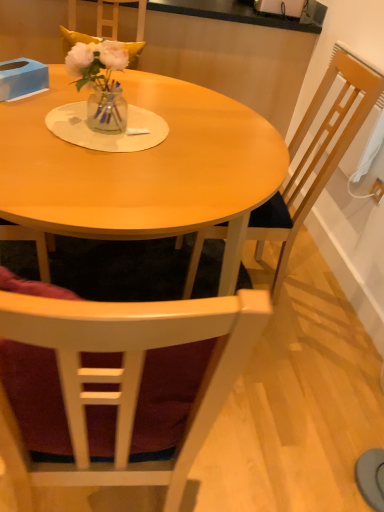
What do you see at coordinates (101, 82) in the screenshot? The height and width of the screenshot is (512, 384). I see `translucent glass vase at center` at bounding box center [101, 82].

Image resolution: width=384 pixels, height=512 pixels. I want to click on blue cardboard box at upper left, so click(x=22, y=78).

Are translucent glass vase at center and wooden chair at center, which is the first chair in bottom-to-top order, beside each other?

translucent glass vase at center and wooden chair at center, which is the first chair in bottom-to-top order, are not in contact.

Measure the distance between translucent glass vase at center and wooden chair at center, which is the first chair in bottom-to-top order.

A distance of 34.81 inches exists between translucent glass vase at center and wooden chair at center, which is the first chair in bottom-to-top order.

Is translucent glass vase at center positioned with its back to wooden chair at center, the 2th chair positioned from the top?

No, translucent glass vase at center is not facing the opposite direction of wooden chair at center, the 2th chair positioned from the top.

Who is bigger, translucent glass vase at center or wooden chair at center, which is the first chair in bottom-to-top order?

wooden chair at center, which is the first chair in bottom-to-top order.

Considering the sizes of objects wooden chair at right, the second chair when ordered from bottom to top, and translucent glass vase at center in the image provided, who is smaller, wooden chair at right, the second chair when ordered from bottom to top, or translucent glass vase at center?

Smaller between the two is translucent glass vase at center.

Is wooden chair at right, the second chair when ordered from bottom to top, facing towards translucent glass vase at center?

Yes, wooden chair at right, the second chair when ordered from bottom to top, is turned towards translucent glass vase at center.

From a real-world perspective, is wooden chair at right, positioned as the 1th chair in top-to-bottom order, under translucent glass vase at center?

Indeed, from a real-world perspective, wooden chair at right, positioned as the 1th chair in top-to-bottom order, is positioned beneath translucent glass vase at center.

In order to click on floral arrangement that appears above the wooden chair at right, positioned as the 1th chair in top-to-bottom order (from the image's perspective) in this screenshot , I will do `click(101, 82)`.

Is wooden chair at right, positioned as the 1th chair in top-to-bottom order, positioned with its back to blue cardboard box at upper left?

wooden chair at right, positioned as the 1th chair in top-to-bottom order, does not have its back to blue cardboard box at upper left.

Which object is closer to the camera taking this photo, wooden chair at right, positioned as the 1th chair in top-to-bottom order, or blue cardboard box at upper left?

wooden chair at right, positioned as the 1th chair in top-to-bottom order, is closer to the camera.

Between wooden chair at right, the second chair when ordered from bottom to top, and blue cardboard box at upper left, which one has smaller size?

With smaller size is blue cardboard box at upper left.

Is wooden chair at right, the second chair when ordered from bottom to top, not close to blue cardboard box at upper left?

wooden chair at right, the second chair when ordered from bottom to top, is near blue cardboard box at upper left, not far away.

From a real-world perspective, is matte wood table at center physically located above or below blue cardboard box at upper left?

Clearly, from a real-world perspective, matte wood table at center is below blue cardboard box at upper left.

Looking at this image, how far apart are matte wood table at center and blue cardboard box at upper left?

matte wood table at center and blue cardboard box at upper left are 46.43 centimeters apart.

Relative to blue cardboard box at upper left, is matte wood table at center in front or behind?

Visually, matte wood table at center is located in front of blue cardboard box at upper left.

From the image's perspective, between matte wood table at center and blue cardboard box at upper left, who is located below?

matte wood table at center, from the image's perspective.

Is there a large distance between wooden chair at right, the second chair when ordered from bottom to top, and wooden chair at center, the 2th chair positioned from the top?

Yes.

Can you tell me how much wooden chair at right, positioned as the 1th chair in top-to-bottom order, and wooden chair at center, the 2th chair positioned from the top, differ in facing direction?

There is a 2.38-degree angle between the facing directions of wooden chair at right, positioned as the 1th chair in top-to-bottom order, and wooden chair at center, the 2th chair positioned from the top.

Looking at this image, between wooden chair at right, the second chair when ordered from bottom to top, and wooden chair at center, which is the first chair in bottom-to-top order, which one appears on the left side from the viewer's perspective?

wooden chair at center, which is the first chair in bottom-to-top order.

Does point (363, 92) appear closer or farther from the camera than point (86, 366)?

Point (363, 92) appears to be farther away from the viewer than point (86, 366).

In the image, is wooden chair at center, the 2th chair positioned from the top, positioned in front of or behind matte wood table at center?

wooden chair at center, the 2th chair positioned from the top, is behind matte wood table at center.

The image size is (384, 512). In order to click on the 1st chair behind the matte wood table at center, starting your count from the anchor in this screenshot , I will do `click(115, 383)`.

Is wooden chair at center, the 2th chair positioned from the top, positioned far away from matte wood table at center?

wooden chair at center, the 2th chair positioned from the top, is actually quite close to matte wood table at center.

From a real-world perspective, is wooden chair at center, the 2th chair positioned from the top, located higher than matte wood table at center?

No, from a real-world perspective, wooden chair at center, the 2th chair positioned from the top, is not above matte wood table at center.

Locate an element on the screen. The image size is (384, 512). power outlet lying on the right of translucent glass vase at center is located at coordinates (377, 190).

Is translucent glass vase at center facing towards white plastic power outlet at upper right?

No, translucent glass vase at center is not turned towards white plastic power outlet at upper right.

Is translucent glass vase at center thinner than white plastic power outlet at upper right?

Incorrect, the width of translucent glass vase at center is not less than that of white plastic power outlet at upper right.

From a real-world perspective, is translucent glass vase at center beneath white plastic power outlet at upper right?

No, from a real-world perspective, translucent glass vase at center is not under white plastic power outlet at upper right.

The width and height of the screenshot is (384, 512). There is a translucent glass vase at center. Find the location of `the 2nd chair below it (from the image's perspective)`. the 2nd chair below it (from the image's perspective) is located at coordinates (115, 383).

The width and height of the screenshot is (384, 512). I want to click on floral arrangement lying above the wooden chair at right, the second chair when ordered from bottom to top (from the image's perspective), so click(x=101, y=82).

Looking at the image, which one is located closer to matte wood table at center, wooden chair at center, the 2th chair positioned from the top, or white plastic power outlet at upper right?

Based on the image, wooden chair at center, the 2th chair positioned from the top, appears to be nearer to matte wood table at center.

When comparing their distances from wooden chair at center, the 2th chair positioned from the top, does matte wood table at center or blue cardboard box at upper left seem further?

blue cardboard box at upper left lies further to wooden chair at center, the 2th chair positioned from the top, than the other object.

When comparing their distances from wooden chair at right, the second chair when ordered from bottom to top, does translucent glass vase at center or blue cardboard box at upper left seem further?

blue cardboard box at upper left.

Considering their positions, is blue cardboard box at upper left positioned closer to white plastic power outlet at upper right than translucent glass vase at center?

The object closer to white plastic power outlet at upper right is translucent glass vase at center.

Based on their spatial positions, is wooden chair at center, the 2th chair positioned from the top, or translucent glass vase at center further from matte wood table at center?

wooden chair at center, the 2th chair positioned from the top.

Based on their spatial positions, is translucent glass vase at center or blue cardboard box at upper left further from white plastic power outlet at upper right?

blue cardboard box at upper left lies further to white plastic power outlet at upper right than the other object.

Considering their positions, is blue cardboard box at upper left positioned closer to matte wood table at center than wooden chair at center, which is the first chair in bottom-to-top order?

blue cardboard box at upper left is closer to matte wood table at center.

When comparing their distances from translucent glass vase at center, does wooden chair at right, the second chair when ordered from bottom to top, or wooden chair at center, the 2th chair positioned from the top, seem closer?

The object closer to translucent glass vase at center is wooden chair at right, the second chair when ordered from bottom to top.

Where is `chair situated between blue cardboard box at upper left and wooden chair at right, positioned as the 1th chair in top-to-bottom order, from left to right`? The image size is (384, 512). chair situated between blue cardboard box at upper left and wooden chair at right, positioned as the 1th chair in top-to-bottom order, from left to right is located at coordinates pyautogui.click(x=115, y=383).

The image size is (384, 512). What are the coordinates of `floral arrangement between blue cardboard box at upper left and white plastic power outlet at upper right in the horizontal direction` in the screenshot? It's located at (101, 82).

The width and height of the screenshot is (384, 512). Find the location of `floral arrangement that lies between blue cardboard box at upper left and wooden chair at center, the 2th chair positioned from the top, from top to bottom`. floral arrangement that lies between blue cardboard box at upper left and wooden chair at center, the 2th chair positioned from the top, from top to bottom is located at coordinates 101,82.

Image resolution: width=384 pixels, height=512 pixels. I want to click on chair between translucent glass vase at center and wooden chair at center, the 2th chair positioned from the top, in the vertical direction, so click(314, 159).